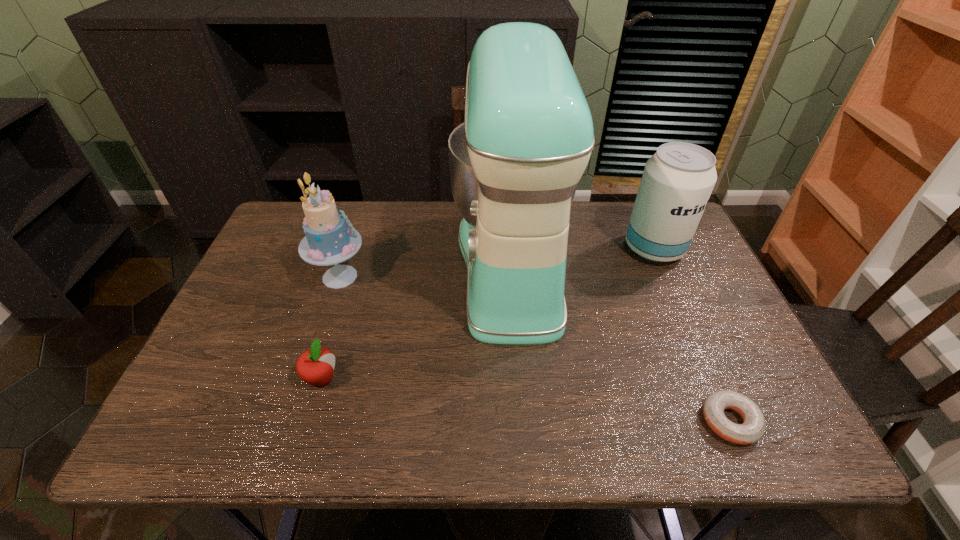
Identify the location of vacant area situated at the base of the third object from left to right. (341, 265).

The height and width of the screenshot is (540, 960). In order to click on free space located 0.400m with a ladder on the side of the cake in this screenshot , I will do `click(511, 276)`.

You are a GUI agent. You are given a task and a screenshot of the screen. Output one action in this format:
    pyautogui.click(x=<x>, y=<y>)
    Task: Click on the free space located 0.310m on the front of the alcohol
    The image size is (960, 540).
    Given the screenshot: What is the action you would take?
    pyautogui.click(x=702, y=358)

Locate an element on the screen. The height and width of the screenshot is (540, 960). free space located 0.250m on the left of the apple is located at coordinates (194, 378).

Identify the location of vacant space located on the back of the doughnut. This screenshot has width=960, height=540. (679, 305).

At what (x,y) coordinates should I click in order to perform the action: click on mixer located in the far edge section of the desktop. Please return your answer as a coordinate pair (x, y). The width and height of the screenshot is (960, 540). Looking at the image, I should click on (527, 137).

What are the coordinates of `alcohol at the far edge` in the screenshot? It's located at (677, 181).

At what (x,y) coordinates should I click in order to perform the action: click on object located at the near edge. Please return your answer as a coordinate pair (x, y). The image size is (960, 540). Looking at the image, I should click on (752, 430).

Image resolution: width=960 pixels, height=540 pixels. In order to click on alcohol that is at the right edge in this screenshot , I will do `click(677, 181)`.

Locate an element on the screen. doughnut at the right edge is located at coordinates (752, 430).